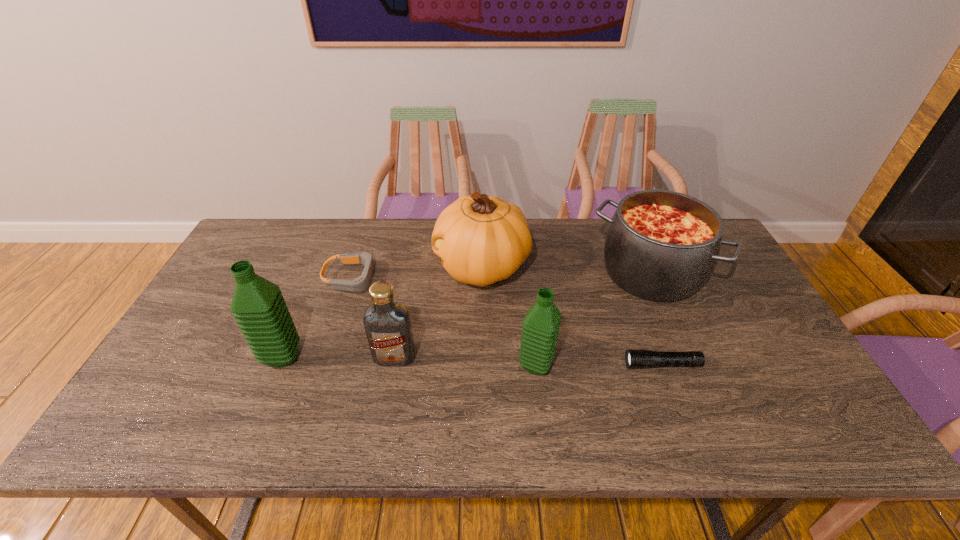
Where is `vacant space that's between the shortest object and the pumpkin`? vacant space that's between the shortest object and the pumpkin is located at coordinates (572, 316).

Where is `free space between the third object from left to right and the right water bottle`? free space between the third object from left to right and the right water bottle is located at coordinates (466, 361).

The width and height of the screenshot is (960, 540). Identify the location of free area in between the flashlight and the goggles. (507, 321).

Locate an element on the screen. free space between the vodka and the left water bottle is located at coordinates (338, 356).

Locate an element on the screen. This screenshot has height=540, width=960. empty location between the casserole and the shortest object is located at coordinates (657, 319).

This screenshot has width=960, height=540. What are the coordinates of `empty location between the pumpkin and the goggles` in the screenshot? It's located at (417, 273).

I want to click on the sixth closest object to the shortest object, so click(x=259, y=309).

The image size is (960, 540). What are the coordinates of `object that is the fifth closest to the shortest object` in the screenshot? It's located at (360, 284).

The height and width of the screenshot is (540, 960). In order to click on free space that satisfies the following two spatial constraints: 1. at the lens end of the shortest object; 2. on the front side of the right water bottle in this screenshot , I will do `click(662, 365)`.

Identify the location of free space that satisfies the following two spatial constraints: 1. on the front face of the pumpkin; 2. on the front side of the left water bottle. This screenshot has height=540, width=960. (482, 356).